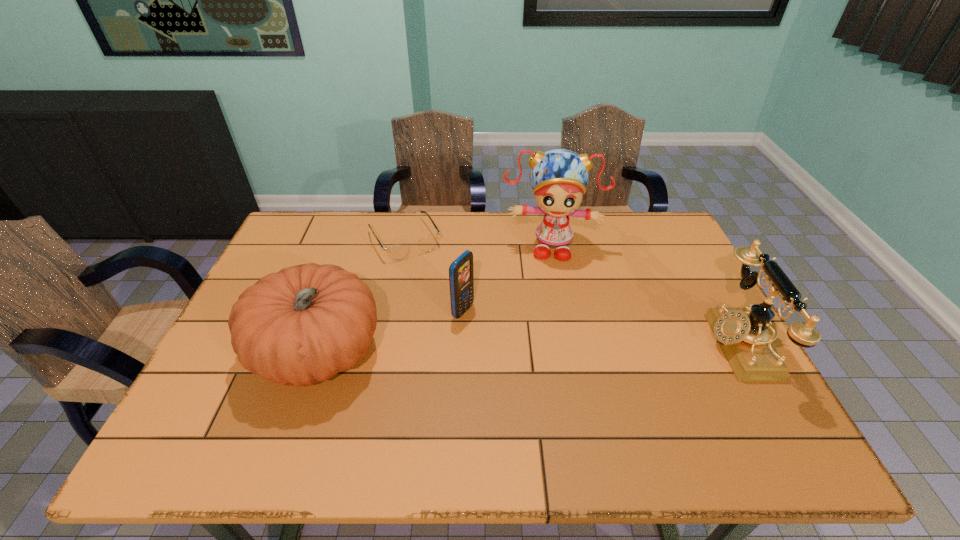
Locate an element on the screen. The width and height of the screenshot is (960, 540). pumpkin is located at coordinates (304, 324).

Where is `telephone`? Image resolution: width=960 pixels, height=540 pixels. telephone is located at coordinates (741, 332).

Where is `the third object from right to left`? the third object from right to left is located at coordinates (461, 276).

You are a GUI agent. You are given a task and a screenshot of the screen. Output one action in this format:
    pyautogui.click(x=<x>, y=<y>)
    Task: Click on the tallest object
    Image resolution: width=960 pixels, height=540 pixels.
    Given the screenshot: What is the action you would take?
    pyautogui.click(x=559, y=177)

The width and height of the screenshot is (960, 540). In order to click on the second object from right to left in this screenshot , I will do `click(559, 177)`.

The image size is (960, 540). I want to click on the shortest object, so click(x=396, y=252).

This screenshot has width=960, height=540. Find the location of `vacant space located 0.340m on the back of the pumpkin`. vacant space located 0.340m on the back of the pumpkin is located at coordinates (358, 234).

The height and width of the screenshot is (540, 960). In order to click on vacant space located on the dial of the rightmost object in this screenshot , I will do `click(558, 345)`.

The width and height of the screenshot is (960, 540). What are the coordinates of `vacant point located 0.290m on the dial of the rightmost object` in the screenshot? It's located at (596, 345).

Find the location of a particular element. The width and height of the screenshot is (960, 540). vacant region located 0.130m on the dial of the rightmost object is located at coordinates (659, 345).